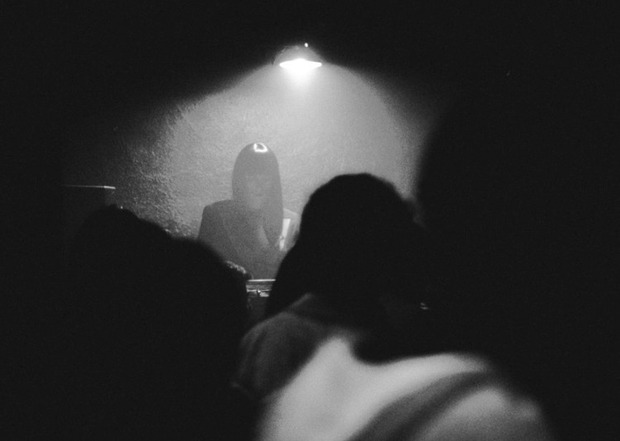
The width and height of the screenshot is (620, 441). Identify the location of lady sitting at desk area. (259, 236), (260, 286).